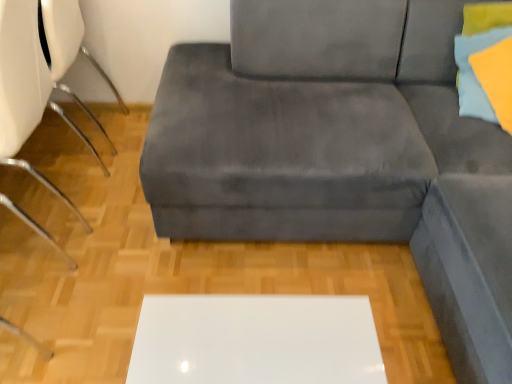
I want to click on vacant region below white plastic chair at left (from a real-world perspective), so click(45, 206).